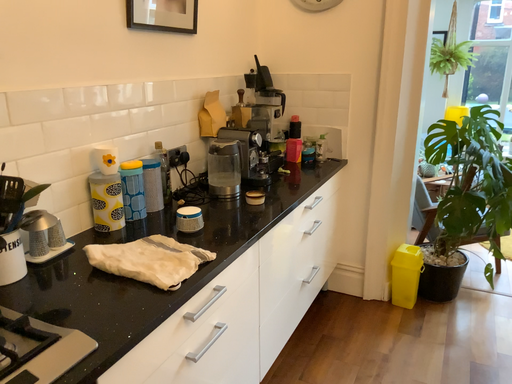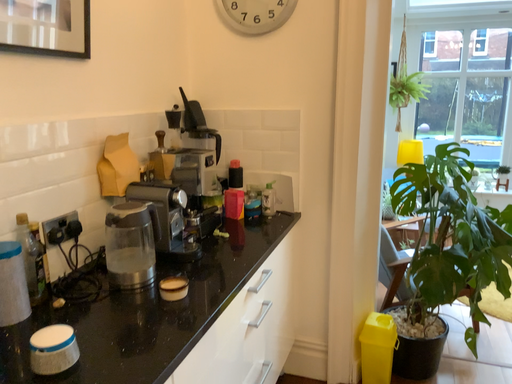
Question: How did the camera likely rotate when shooting the video?

Choices:
 (A) rotated right
 (B) rotated left

Answer: (A)